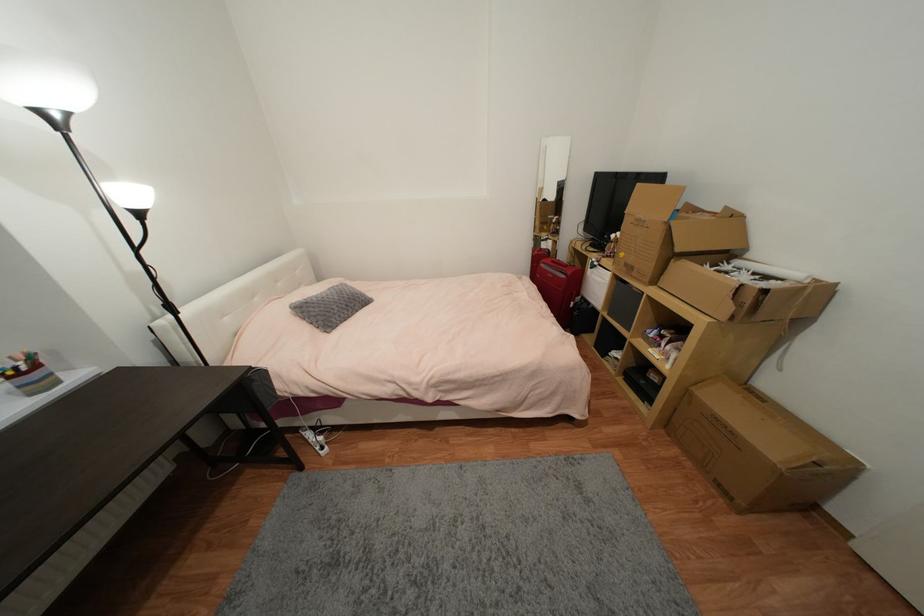
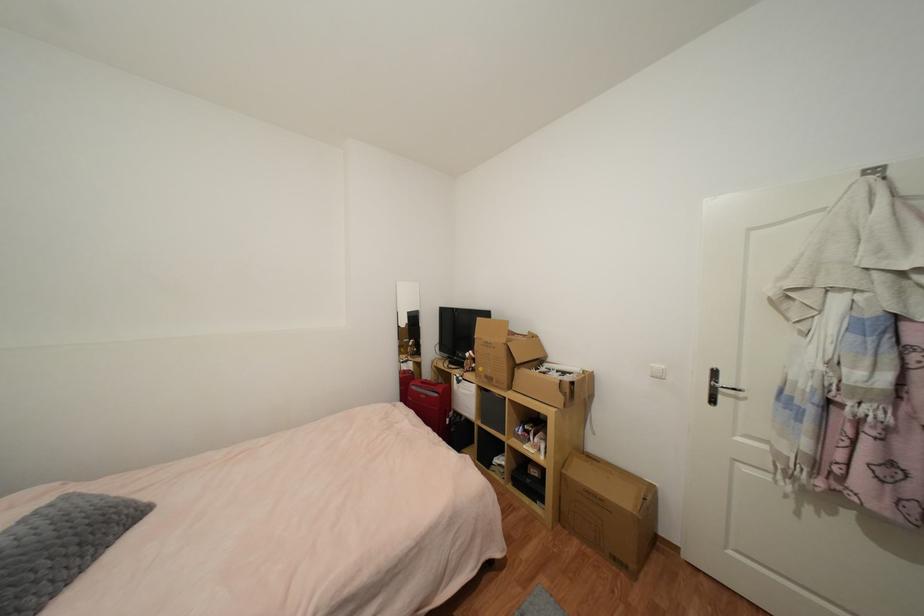
The images are taken continuously from a first-person perspective. In which direction is your viewpoint rotating?

The camera rotated toward right-up.